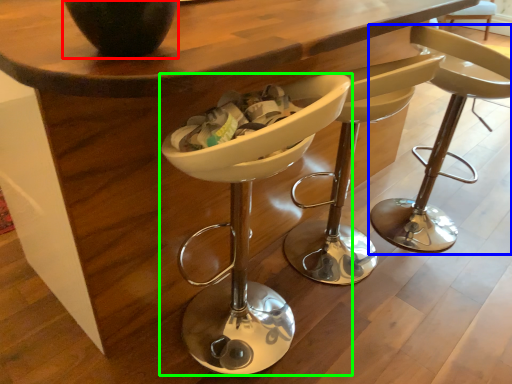
Question: Considering the real-world distances, which object is farthest from vase (highlighted by a red box)? chair (highlighted by a blue box) or chair (highlighted by a green box)?

Choices:
 (A) chair
 (B) chair

Answer: (A)